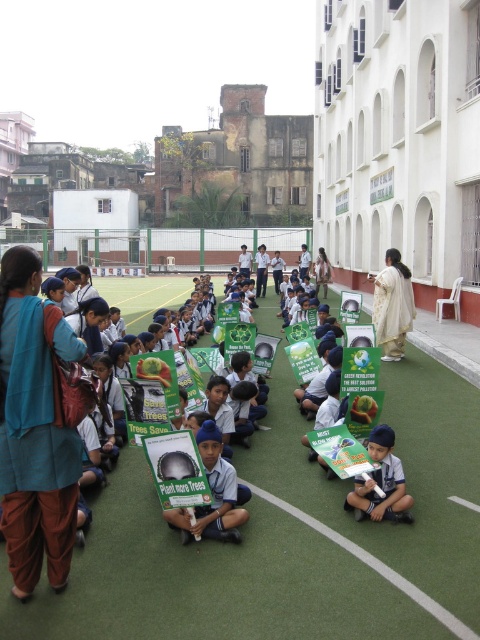
You are a photographer standing at the bottom left corner of the image. You want to take a photo of the white textured dress at center. Which direction should you move to get the dress into your camera frame?

Since the white textured dress at center is located at coordinates approximately 0.478 on the x and 0.819 on the y axis, you should move towards the center of the image to capture it in your frame.

You are a photographer positioned at the back of the scene. You need to capture a photo where both the blue cotton kurta at center and the white uniform child at center are clearly visible. Considering their heights, which one should you focus on first to ensure both are in frame?

The blue cotton kurta at center is taller than the white uniform child at center, so focusing on the blue cotton kurta at center first will ensure the white uniform child at center is also in frame since it is shorter.

You are a photographer at the event and need to ensure that both the blue cotton kurta at center and the white uniform child at center are clearly visible in your photo. Which one should you focus on first to ensure proper focus, considering their sizes?

The blue cotton kurta at center is bigger than the white uniform child at center, so you should focus on the blue cotton kurta at center first to ensure proper focus.